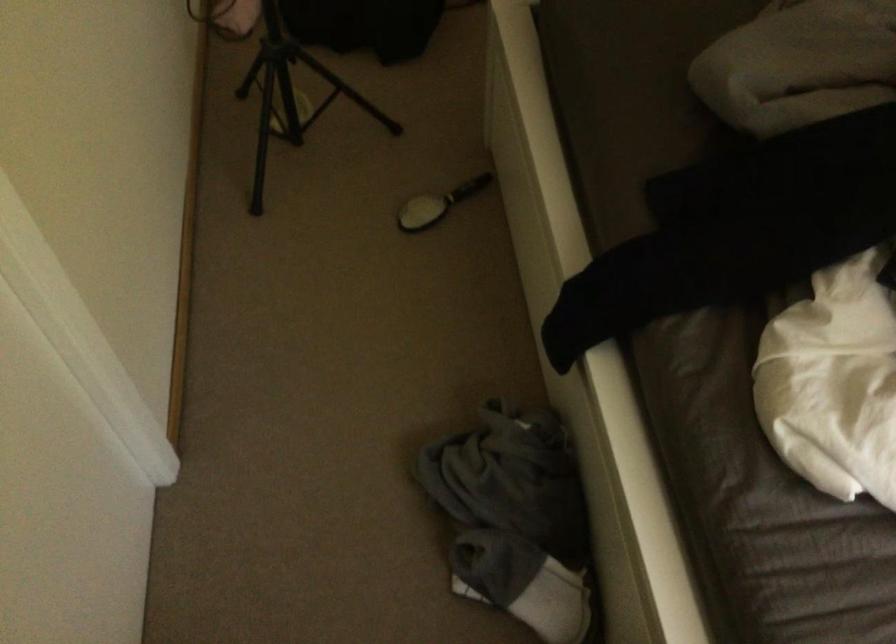
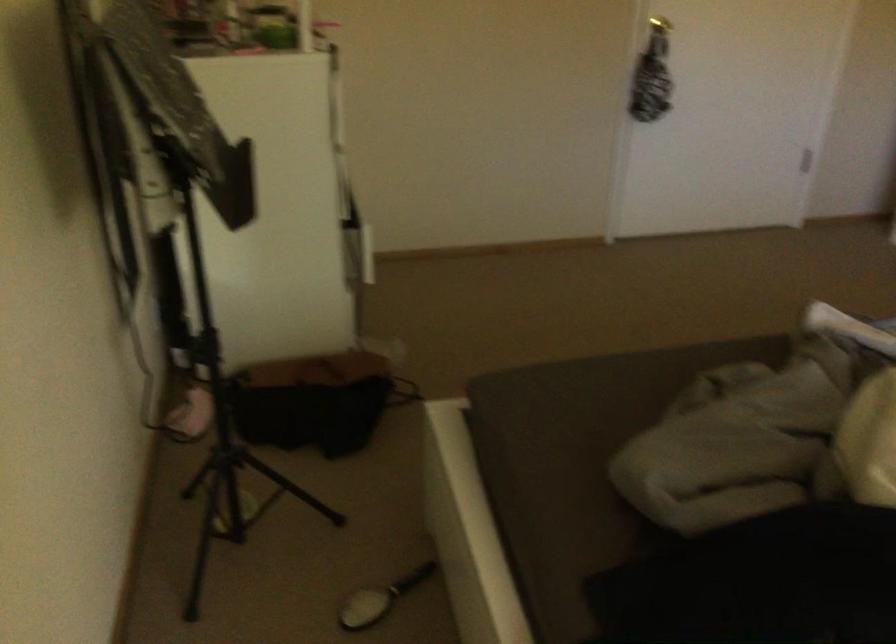
Where in the second image is the point corresponding to (x=435, y=202) from the first image?

(380, 599)